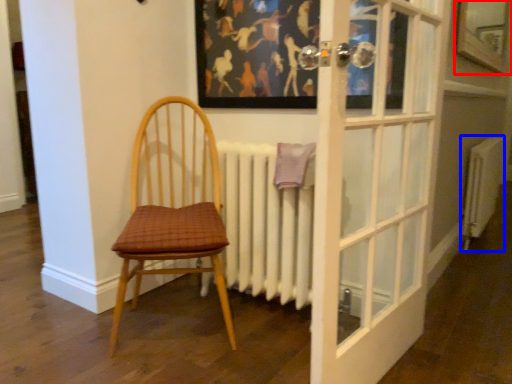
Question: Which point is further to the camera, window (highlighted by a red box) or radiator (highlighted by a blue box)?

Choices:
 (A) window
 (B) radiator

Answer: (B)